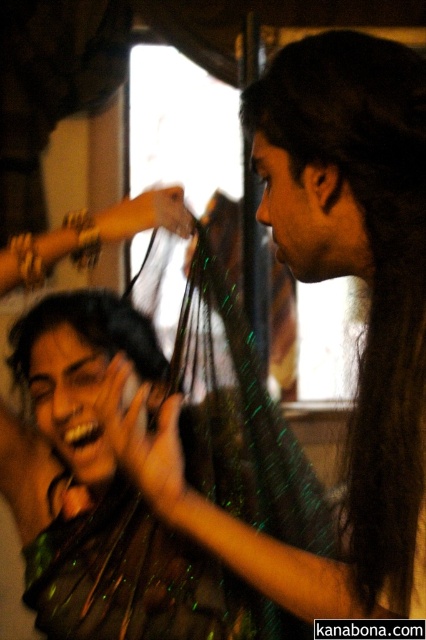
You are a photographer trying to capture a photo of both the dark green silky hair at center and the shiny black hair at center. Which hair is closer to the left side of the camera frame?

The shiny black hair at center is closer to the left side of the camera frame because the dark green silky hair at center is positioned on the right side of it.

In the scene shown: You are a photographer trying to capture a closeup of both the dark green silky hair at center and the shiny black hair at center. Since you want to focus on both, which hair should you adjust your camera focus to first based on their height?

The dark green silky hair at center is much taller than the shiny black hair at center, so you should focus on the dark green silky hair at center first to ensure both are in focus.

In the scene of a lively social gathering, there are two people at the center. One has dark green silky hair at center and the other has shiny black hair at center. Which person has hair with a smaller size?

The dark green silky hair at center is smaller than the shiny black hair at center, so the person with dark green silky hair at center has hair with a smaller size.